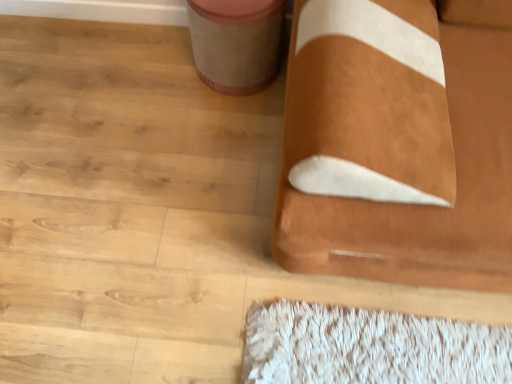
Question: From the image's perspective, is matte beige potty at upper center over brown suede pillow at center?

Choices:
 (A) yes
 (B) no

Answer: (A)

Question: Considering the relative sizes of matte beige potty at upper center and brown suede pillow at center in the image provided, is matte beige potty at upper center taller than brown suede pillow at center?

Choices:
 (A) yes
 (B) no

Answer: (B)

Question: Is matte beige potty at upper center not within brown suede pillow at center?

Choices:
 (A) no
 (B) yes

Answer: (B)

Question: Is matte beige potty at upper center wider than brown suede pillow at center?

Choices:
 (A) yes
 (B) no

Answer: (B)

Question: From the image's perspective, does matte beige potty at upper center appear lower than brown suede pillow at center?

Choices:
 (A) no
 (B) yes

Answer: (A)

Question: From a real-world perspective, is matte beige potty at upper center located beneath brown suede pillow at center?

Choices:
 (A) no
 (B) yes

Answer: (B)

Question: Is brown suede pillow at center positioned before matte beige potty at upper center?

Choices:
 (A) yes
 (B) no

Answer: (A)

Question: Considering the relative sizes of brown suede pillow at center and matte beige potty at upper center in the image provided, is brown suede pillow at center taller than matte beige potty at upper center?

Choices:
 (A) yes
 (B) no

Answer: (A)

Question: Is the depth of brown suede pillow at center greater than that of matte beige potty at upper center?

Choices:
 (A) no
 (B) yes

Answer: (A)

Question: Considering the relative sizes of brown suede pillow at center and matte beige potty at upper center in the image provided, is brown suede pillow at center wider than matte beige potty at upper center?

Choices:
 (A) yes
 (B) no

Answer: (A)

Question: Is brown suede pillow at center smaller than matte beige potty at upper center?

Choices:
 (A) no
 (B) yes

Answer: (A)

Question: From the image's perspective, is brown suede pillow at center on top of matte beige potty at upper center?

Choices:
 (A) no
 (B) yes

Answer: (A)

Question: Does point (362, 64) appear closer or farther from the camera than point (224, 57)?

Choices:
 (A) farther
 (B) closer

Answer: (B)